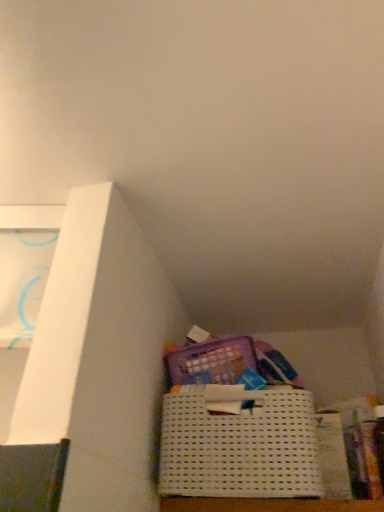
Question: From their relative heights in the image, would you say white paper at lower right is taller or shorter than white woven basket at lower center?

Choices:
 (A) short
 (B) tall

Answer: (B)

Question: Is point (334, 480) closer or farther from the camera than point (276, 393)?

Choices:
 (A) closer
 (B) farther

Answer: (B)

Question: Based on their sizes in the image, would you say white paper at lower right is bigger or smaller than white woven basket at lower center?

Choices:
 (A) small
 (B) big

Answer: (A)

Question: In terms of size, does white woven basket at lower center appear bigger or smaller than white paper at lower right?

Choices:
 (A) small
 (B) big

Answer: (B)

Question: Considering the positions of white woven basket at lower center and white paper at lower right in the image, is white woven basket at lower center taller or shorter than white paper at lower right?

Choices:
 (A) tall
 (B) short

Answer: (B)

Question: From a real-world perspective, is white woven basket at lower center above or below white paper at lower right?

Choices:
 (A) above
 (B) below

Answer: (A)

Question: Is point (218, 453) closer or farther from the camera than point (317, 417)?

Choices:
 (A) farther
 (B) closer

Answer: (B)